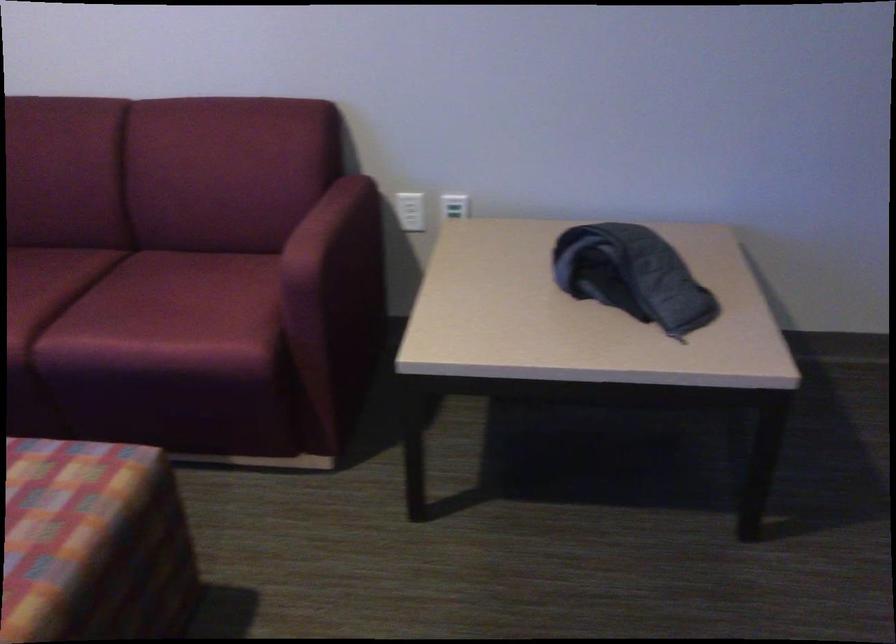
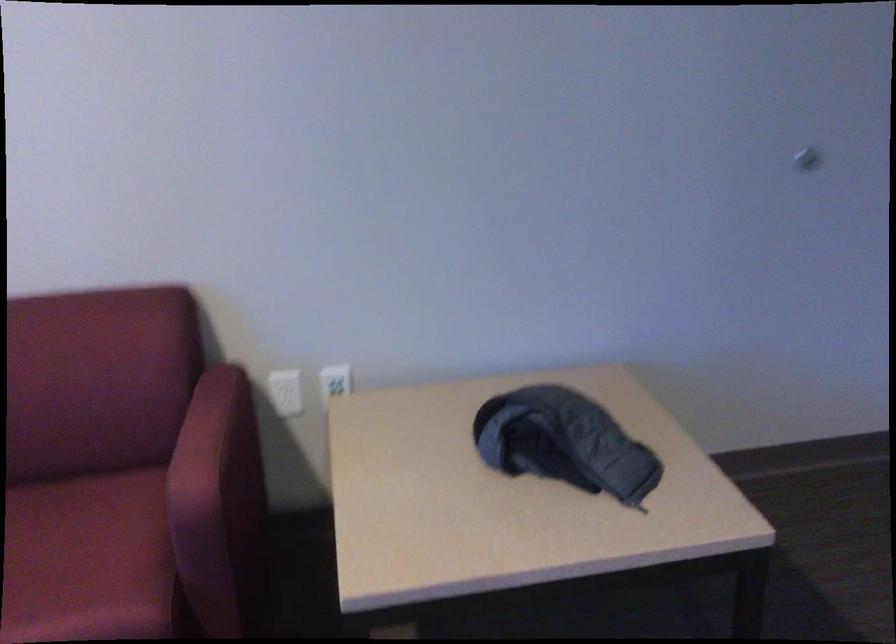
Locate, in the second image, the point that corresponds to point 220,306 in the first image.

(88, 560)